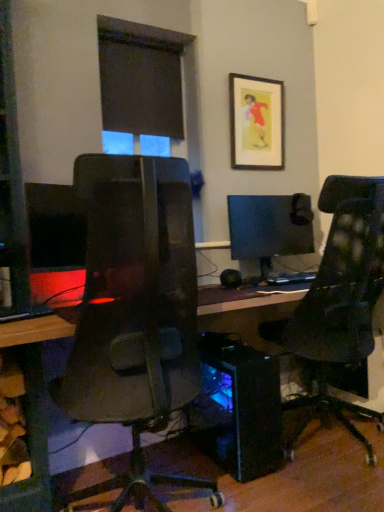
At what (x,y) coordinates should I click in order to perform the action: click on vacant space positioned to the left of transparent blue computer tower at center. Please return your answer as a coordinate pair (x, y). Looking at the image, I should click on (173, 465).